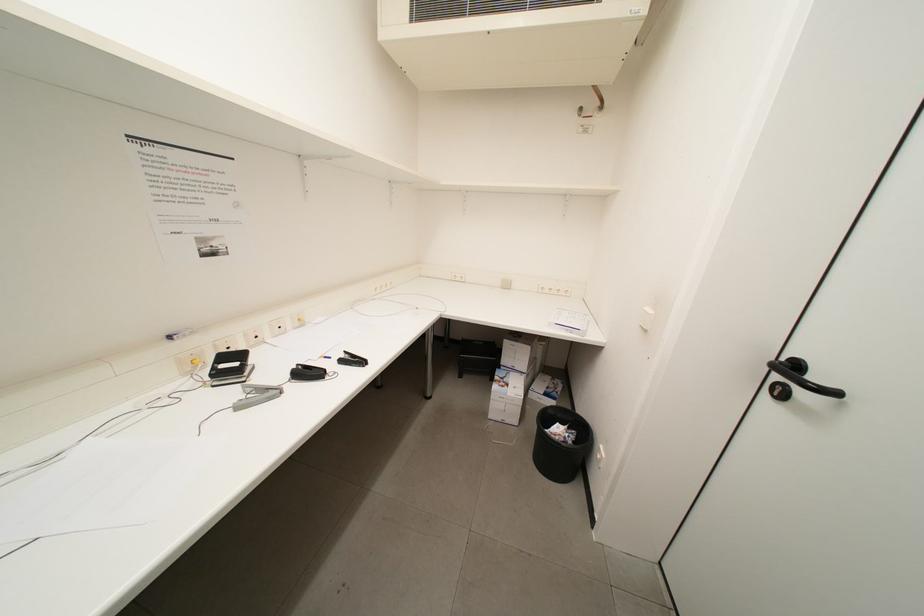
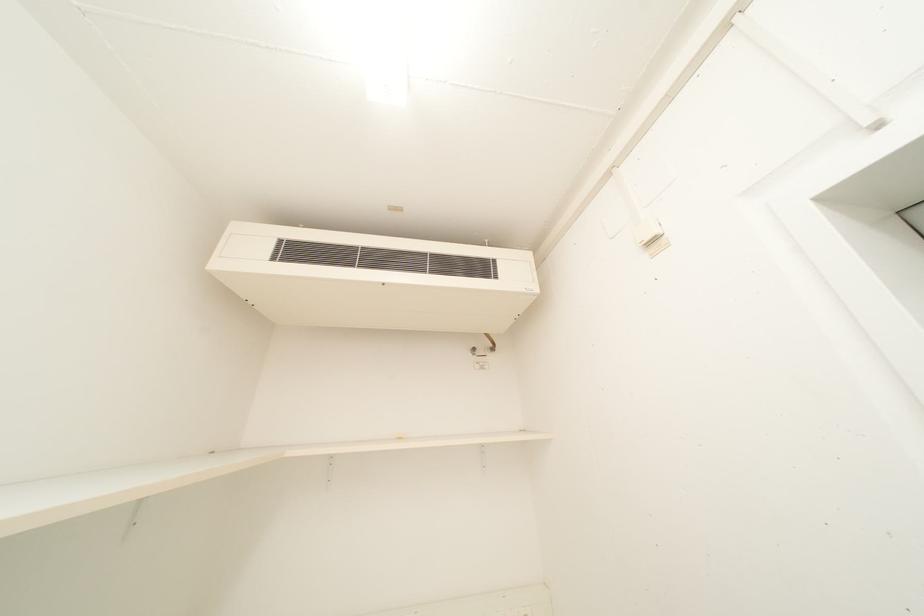
The first image is from the beginning of the video and the second image is from the end. How did the camera likely rotate when shooting the video?

The camera's rotation is toward right-up.